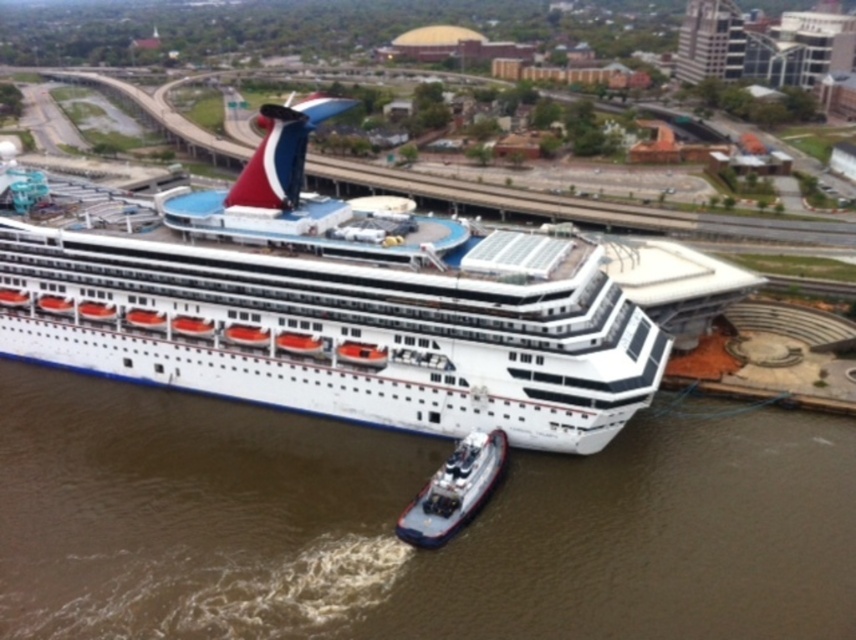
Question: Which point appears farthest from the camera in this image?

Choices:
 (A) (367, 316)
 (B) (443, 541)

Answer: (A)

Question: Is white glossy cruise ship at center wider than metallic gray tugboat at lower center?

Choices:
 (A) no
 (B) yes

Answer: (B)

Question: Is white glossy cruise ship at center to the right of metallic gray tugboat at lower center from the viewer's perspective?

Choices:
 (A) no
 (B) yes

Answer: (A)

Question: Is white glossy cruise ship at center to the left of metallic gray tugboat at lower center from the viewer's perspective?

Choices:
 (A) yes
 (B) no

Answer: (A)

Question: Which of the following is the farthest from the observer?

Choices:
 (A) white glossy cruise ship at center
 (B) metallic gray tugboat at lower center

Answer: (A)